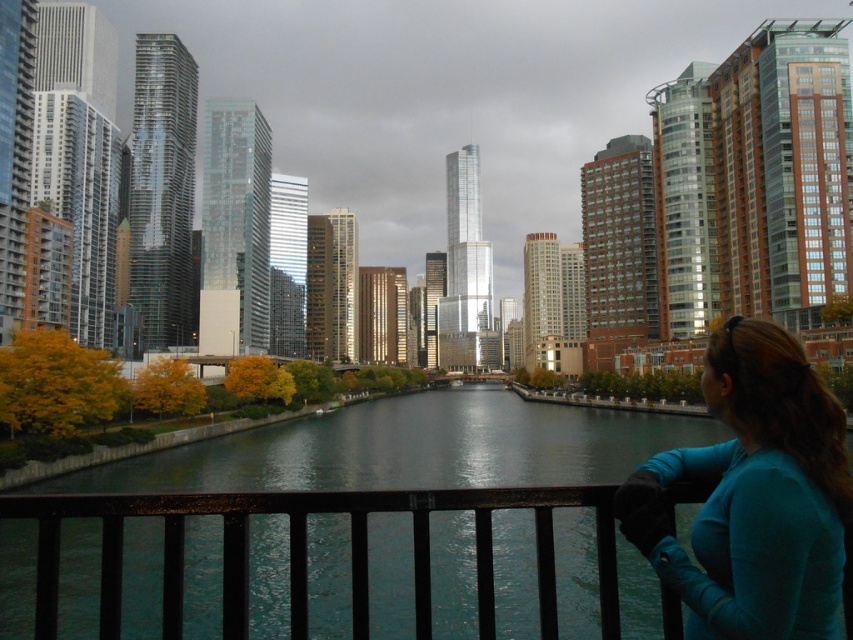
In the scene shown: You are a photographer standing on the bridge and want to capture both the teal fabric shirt at lower right and the metallic black railing at lower center in a single shot. Based on their sizes in the image, which object would you need to position closer to the camera to ensure both are visible in the frame?

The teal fabric shirt at lower right occupies less space than the metallic black railing at lower center. To ensure both are visible in the frame, you should position the teal fabric shirt at lower right closer to the camera since it is smaller and needs to be enlarged in the shot.

You are a photographer standing on the bridge and want to capture a photo of the city skyline. You notice the teal fabric shirt at lower right and the metallic black railing at lower center in your viewfinder. Which object appears narrower in the photo?

The teal fabric shirt at lower right appears narrower than the metallic black railing at lower center in the photo.